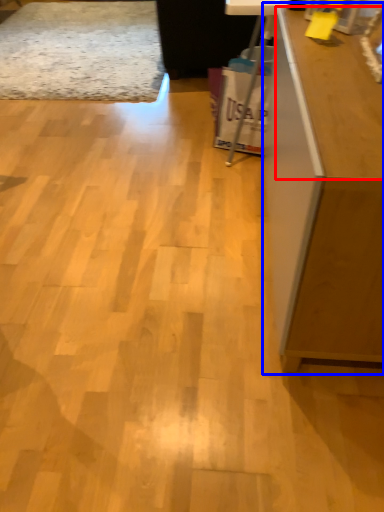
Question: Which object appears farthest to the camera in this image, counter top (highlighted by a red box) or furniture (highlighted by a blue box)?

Choices:
 (A) counter top
 (B) furniture

Answer: (A)